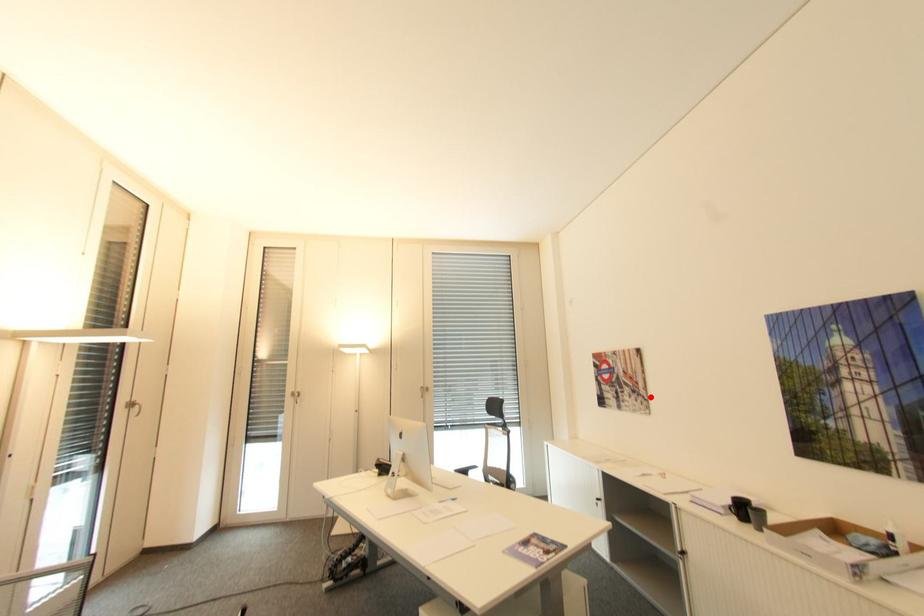
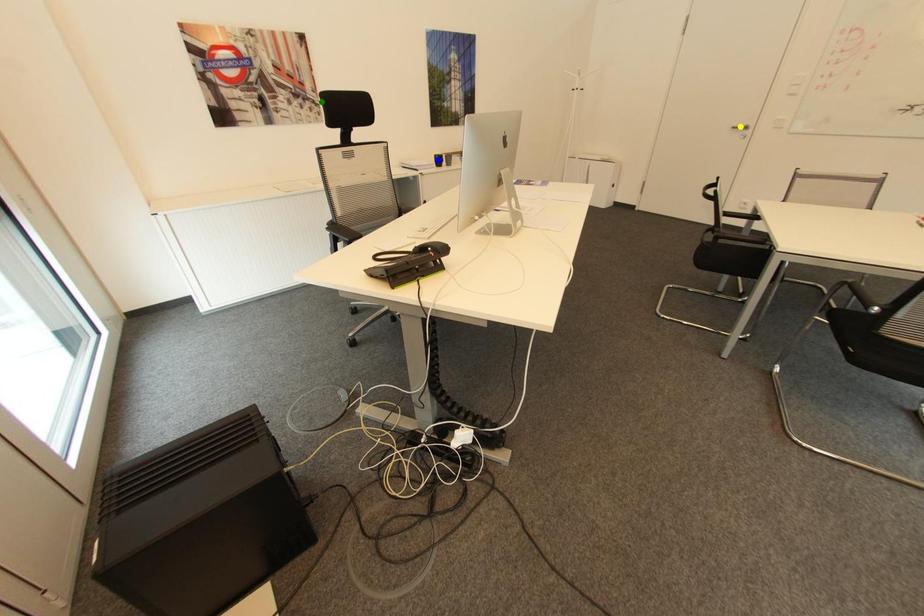
Question: I am providing you with two images of the same scene from different viewpoints. A red point is marked on the first image. You are given multiple points on the second image. Which point in image 2 represents the same 3d spot as the red point in image 1?

Choices:
 (A) yellow point
 (B) green point
 (C) blue point

Answer: (B)